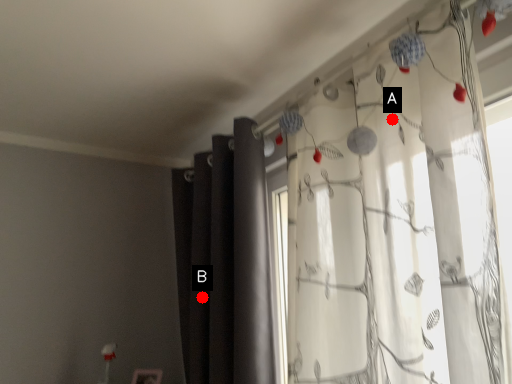
Question: Two points are circled on the image, labeled by A and B beside each circle. Which point is closer to the camera taking this photo?

Choices:
 (A) A is closer
 (B) B is closer

Answer: (A)